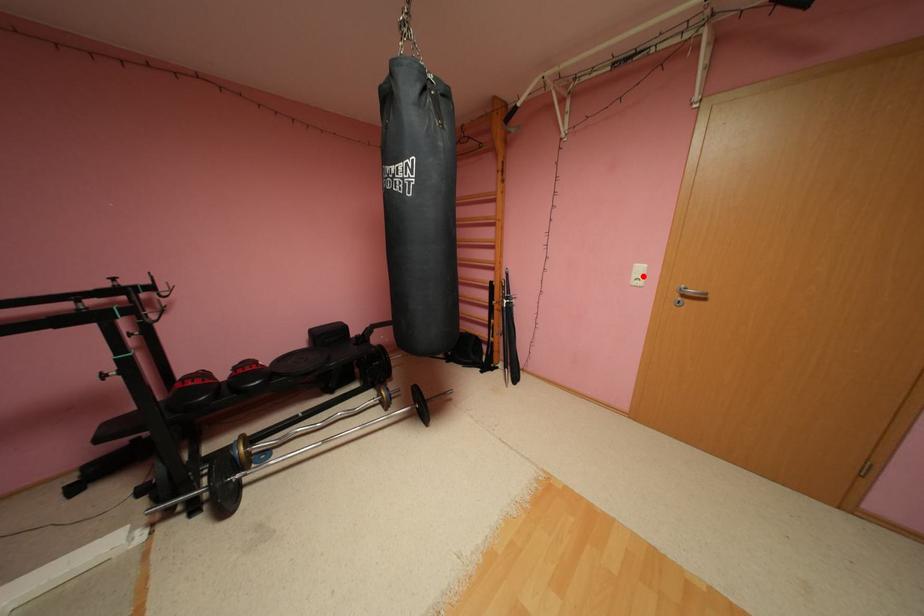
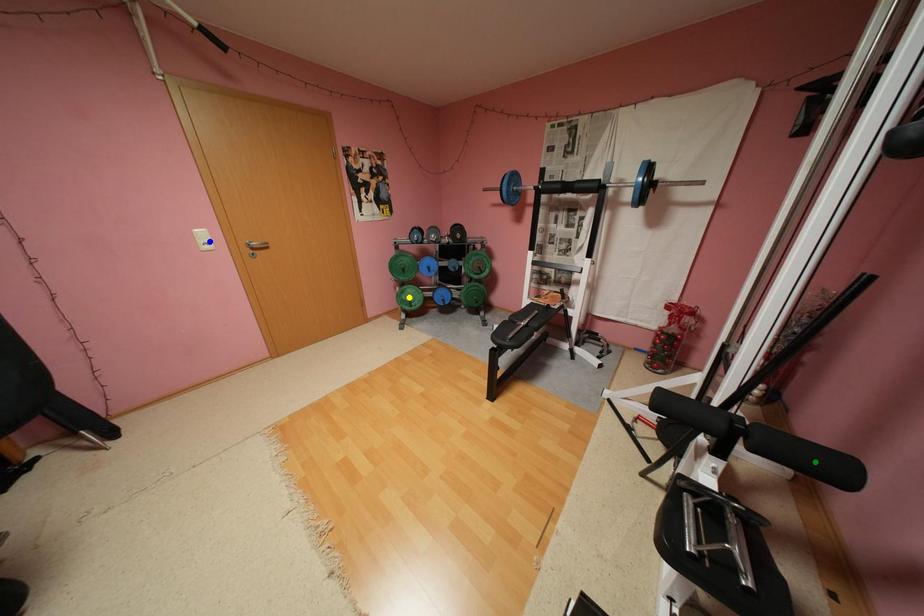
Question: I am providing you with two images of the same scene from different viewpoints. A red point is marked on the first image. You are given multiple points on the second image. Which mark in image 2 goes with the point in image 1?

Choices:
 (A) yellow point
 (B) green point
 (C) blue point

Answer: (C)